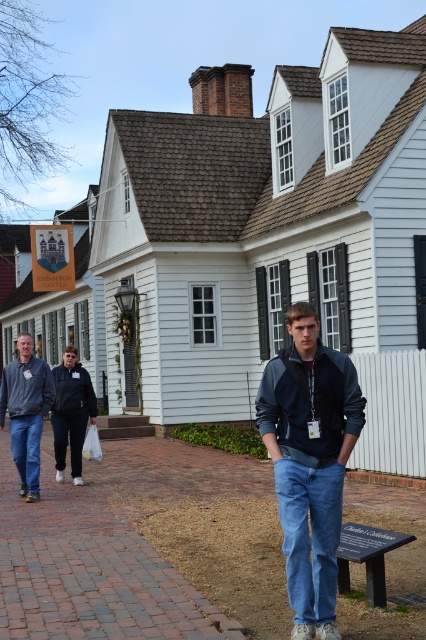
You are a visitor at this historical site and see two jackets displayed on a rack near the entrance. The denim jacket at center and the gray fleece jacket at left. Which jacket is closer to you?

The denim jacket at center is closer to you because it is in front of the gray fleece jacket at left.